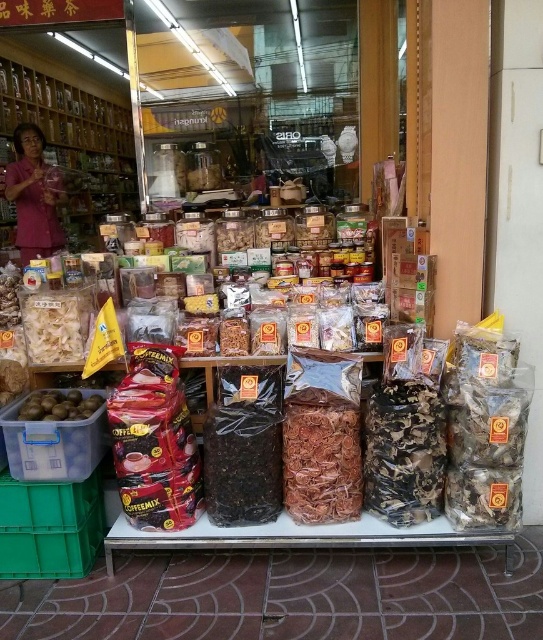
What is the color of the object located at the coordinates (33, 196) in the image?

The point at coordinates (33, 196) corresponds to the pink fabric at left.

You are standing in front of the shop and want to pick up the green matte fruit at lower left. Is the pink fabric at left blocking your direct path to it?

The pink fabric at left is further to the viewer than the green matte fruit at lower left, so it is closer to you and would block your path to the green matte fruit at lower left.

You are a delivery person carrying a box that is 3 meters long. You need to navigate through the space between the pink fabric at left and the green matte fruit at lower left. Can your box fit through that space?

The distance between the pink fabric at left and the green matte fruit at lower left is 2.65 meters. Since the box is 3 meters long, it cannot fit through the space as it is longer than the available distance.